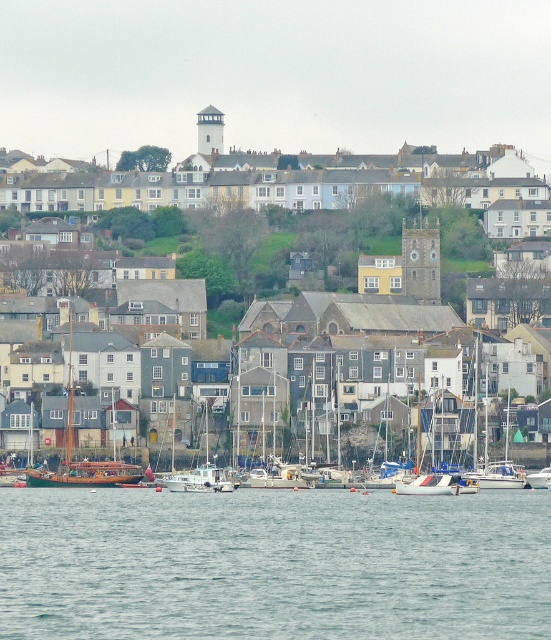
Is white matte buildings at center smaller than white matte sailboat at center-right?

Incorrect, white matte buildings at center is not smaller in size than white matte sailboat at center-right.

Is white matte buildings at center further to the viewer compared to white matte sailboat at center-right?

That is True.

Who is more forward, (217, 145) or (476, 340)?

Point (476, 340)

Identify the location of white matte buildings at center. (226, 182).

Is clear water at lower center shorter than wooden sailboat at center?

Yes, clear water at lower center is shorter than wooden sailboat at center.

In the scene shown: Who is positioned more to the right, clear water at lower center or wooden sailboat at center?

clear water at lower center

What do you see at coordinates (272, 564) in the screenshot?
I see `clear water at lower center` at bounding box center [272, 564].

The height and width of the screenshot is (640, 551). I want to click on clear water at lower center, so pyautogui.click(x=272, y=564).

Can you confirm if white matte sailboat at center is positioned above wooden sailboat at center?

No, white matte sailboat at center is not above wooden sailboat at center.

Does white matte sailboat at center appear on the left side of wooden sailboat at center?

Incorrect, white matte sailboat at center is not on the left side of wooden sailboat at center.

This screenshot has height=640, width=551. I want to click on white matte sailboat at center, so click(x=258, y=417).